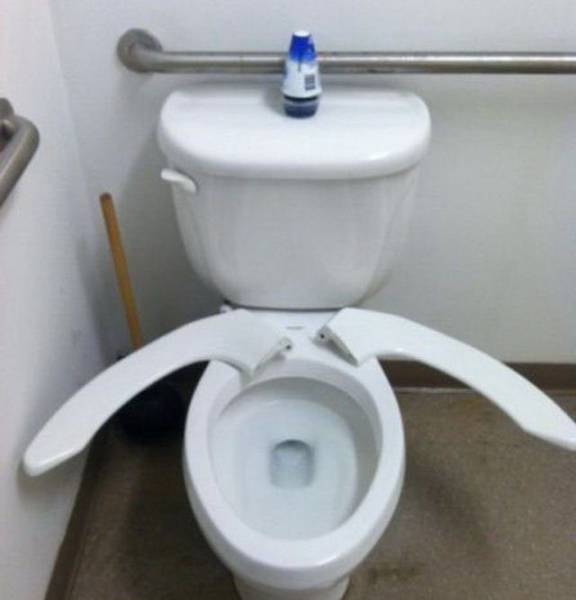
Locate an element on the screen. The height and width of the screenshot is (600, 576). walls is located at coordinates (468, 179), (34, 298).